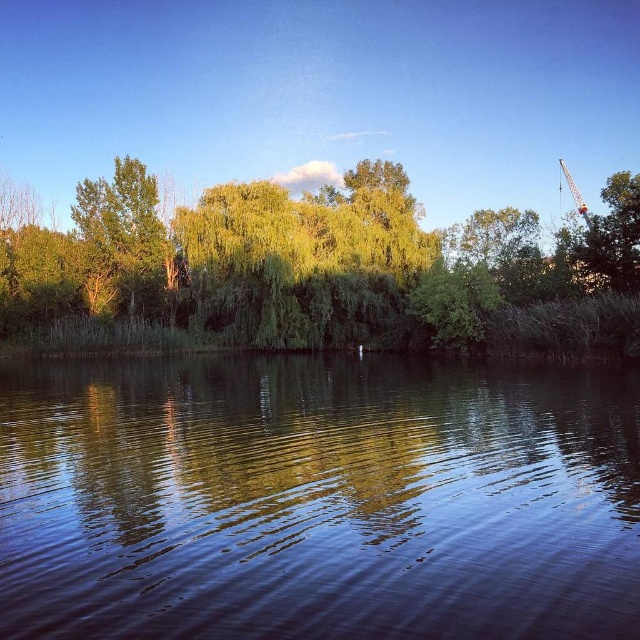
Question: Among these objects, which one is farthest from the camera?

Choices:
 (A) smooth dark water at center
 (B) metallic yellow crane at upper right
 (C) green leafy tree at center
 (D) green leafy tree at left

Answer: (D)

Question: Is green leafy tree at left wider than metallic yellow crane at upper right?

Choices:
 (A) yes
 (B) no

Answer: (B)

Question: Which point is farther to the camera?

Choices:
 (A) (106, 237)
 (B) (460, 236)

Answer: (A)

Question: Is smooth dark water at center to the left of metallic yellow crane at upper right from the viewer's perspective?

Choices:
 (A) no
 (B) yes

Answer: (B)

Question: Is green leafy tree at left thinner than metallic yellow crane at upper right?

Choices:
 (A) yes
 (B) no

Answer: (A)

Question: Which of these objects is positioned closest to the smooth dark water at center?

Choices:
 (A) green leafy tree at center
 (B) metallic yellow crane at upper right

Answer: (A)